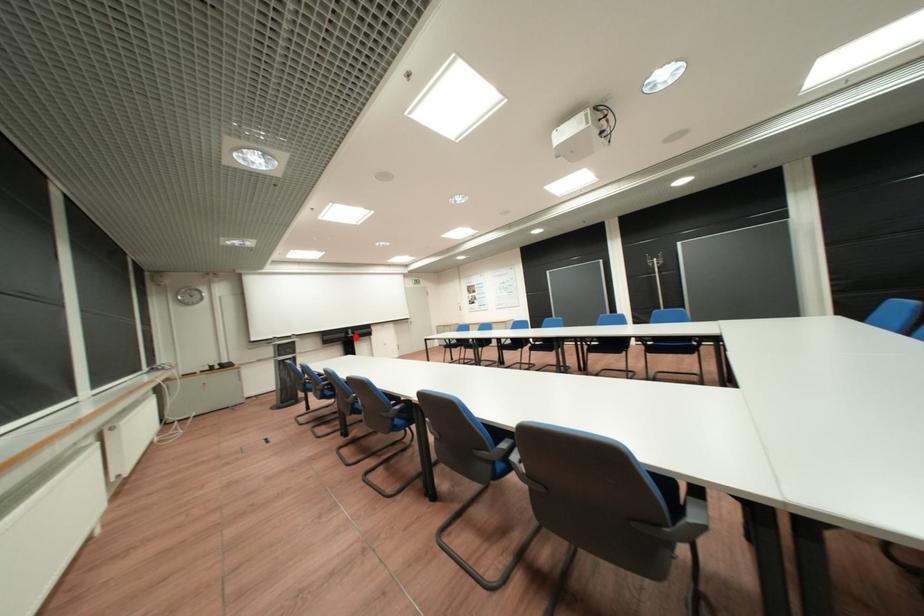
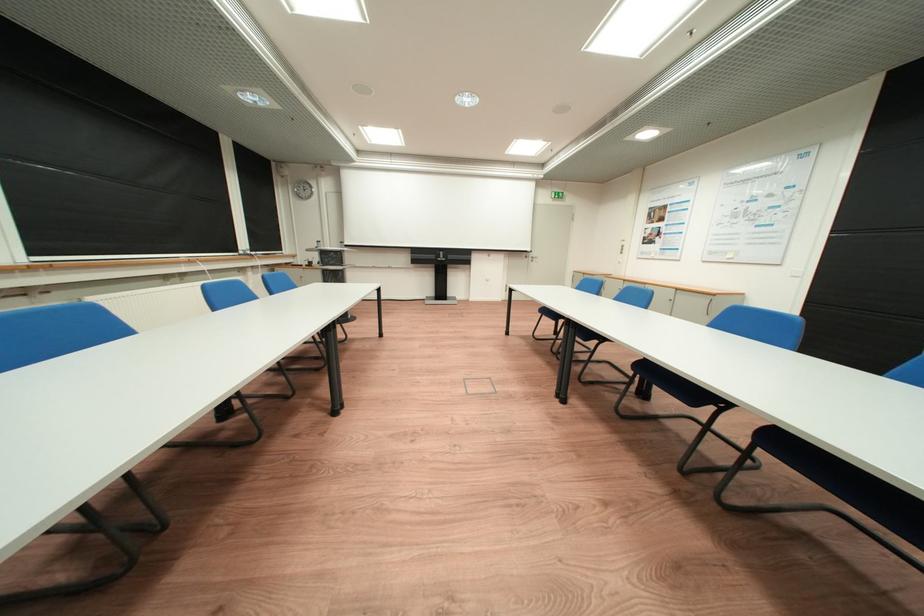
The point at the highlighted location is marked in the first image. Where is the corresponding point in the second image?

(445, 257)